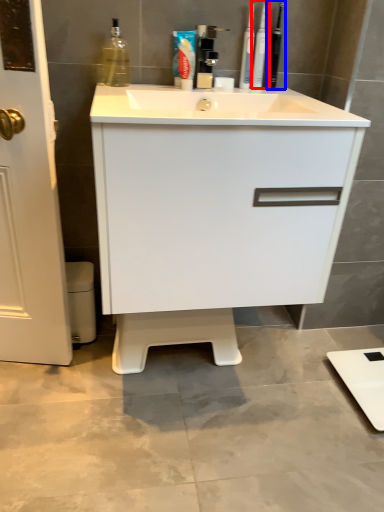
Question: Which point is further to the camera, toiletry (highlighted by a red box) or toiletry (highlighted by a blue box)?

Choices:
 (A) toiletry
 (B) toiletry

Answer: (B)